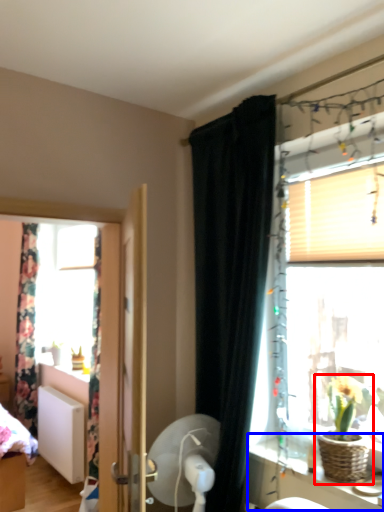
Question: Among these objects, which one is nearest to the camera, houseplant (highlighted by a red box) or vanity (highlighted by a blue box)?

Choices:
 (A) houseplant
 (B) vanity

Answer: (B)